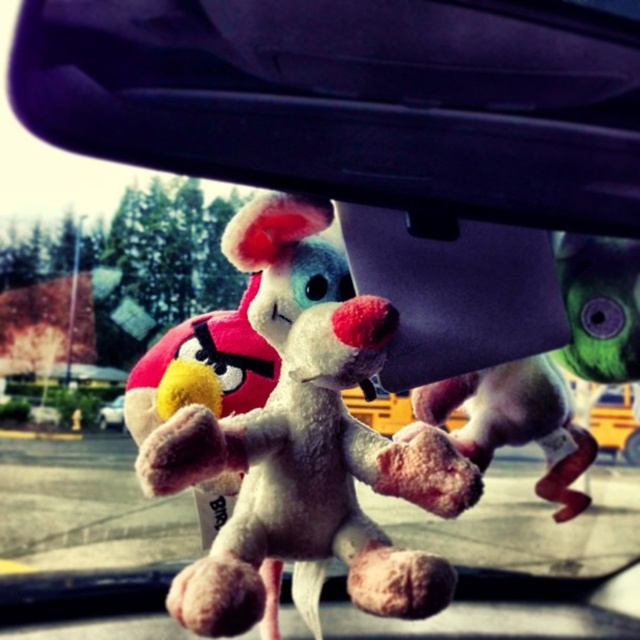
How much distance is there between white plush toy at center and metallic silver car at lower left?

white plush toy at center and metallic silver car at lower left are 23.69 inches apart from each other.

Which is below, white plush toy at center or metallic silver car at lower left?

metallic silver car at lower left is below.

Where is `white plush toy at center`? The width and height of the screenshot is (640, 640). white plush toy at center is located at coordinates (515, 420).

Does black plastic rearview mirror at upper center have a greater width compared to white plush toy at center?

Yes, black plastic rearview mirror at upper center is wider than white plush toy at center.

Is point (406, 92) closer to camera compared to point (529, 397)?

Yes.

This screenshot has height=640, width=640. What do you see at coordinates (352, 99) in the screenshot?
I see `black plastic rearview mirror at upper center` at bounding box center [352, 99].

The height and width of the screenshot is (640, 640). In order to click on black plastic rearview mirror at upper center in this screenshot , I will do `click(352, 99)`.

Who is more forward, (x=330, y=342) or (x=577, y=444)?

Point (x=330, y=342) is in front.

Is fluffy white plush toy at center bigger than white plush toy at center?

Yes, fluffy white plush toy at center is bigger than white plush toy at center.

Describe the element at coordinates (304, 445) in the screenshot. I see `fluffy white plush toy at center` at that location.

This screenshot has height=640, width=640. Find the location of `fluffy white plush toy at center`. fluffy white plush toy at center is located at coordinates (304, 445).